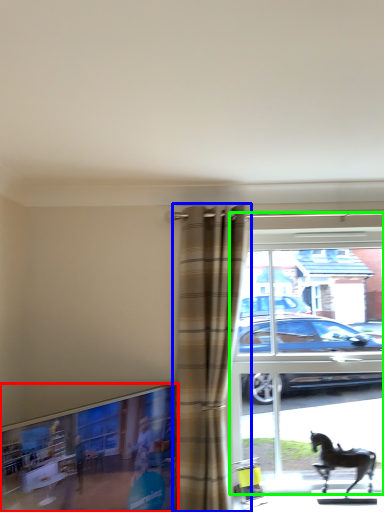
Question: Which object is the closest to the window frame (highlighted by a red box)? Choose among these: curtain (highlighted by a blue box) or window (highlighted by a green box).

Choices:
 (A) curtain
 (B) window

Answer: (A)